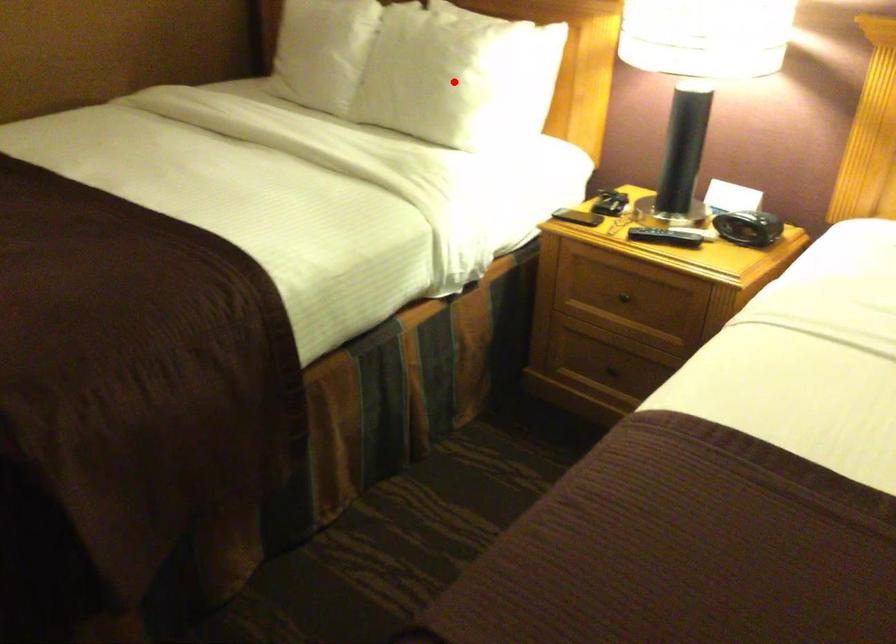
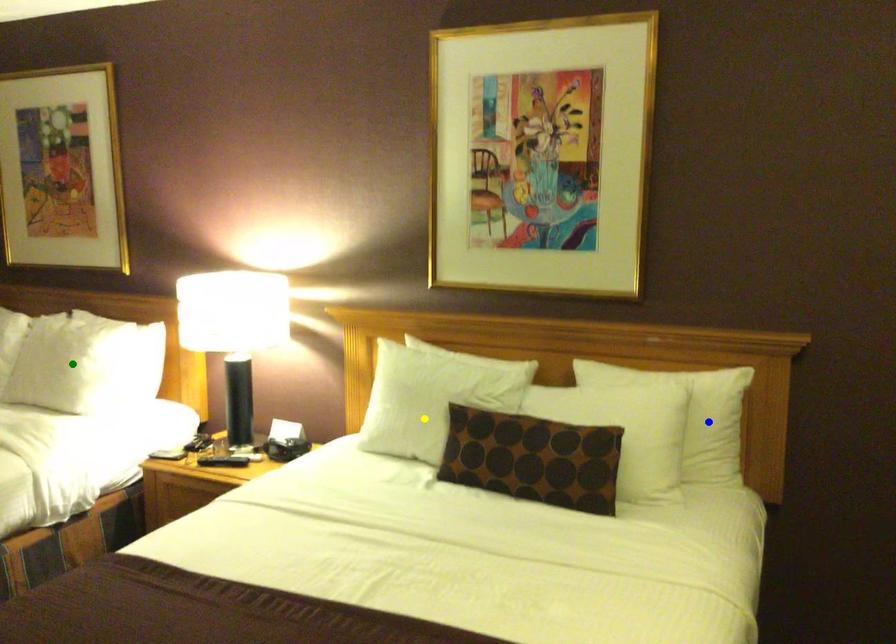
Question: I am providing you with two images of the same scene from different viewpoints. A red point is marked on the first image. You are given multiple points on the second image. Can you choose the point in image 2 that corresponds to the point in image 1?

Choices:
 (A) green point
 (B) yellow point
 (C) blue point

Answer: (A)